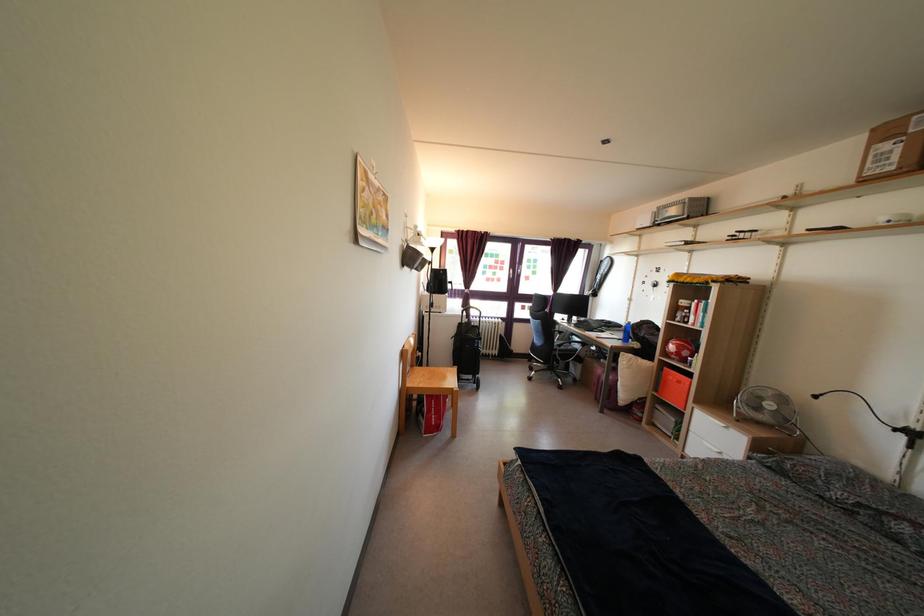
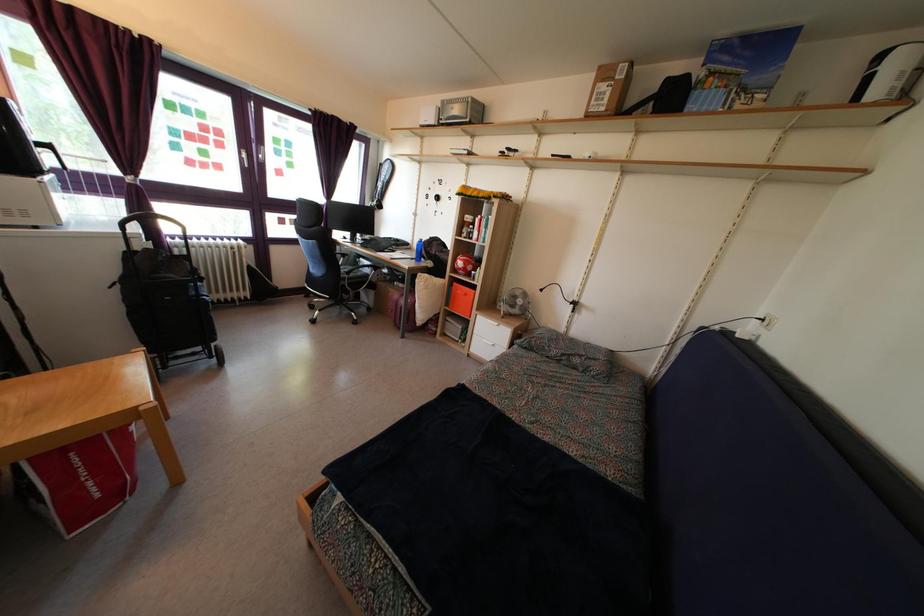
Where in the second image is the point corresponding to pixel 675 357 from the first image?

(463, 272)